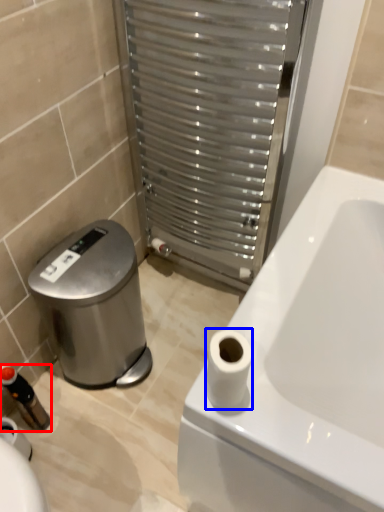
Question: Which point is further to the camera, toiletry (highlighted by a red box) or toilet paper (highlighted by a blue box)?

Choices:
 (A) toiletry
 (B) toilet paper

Answer: (A)